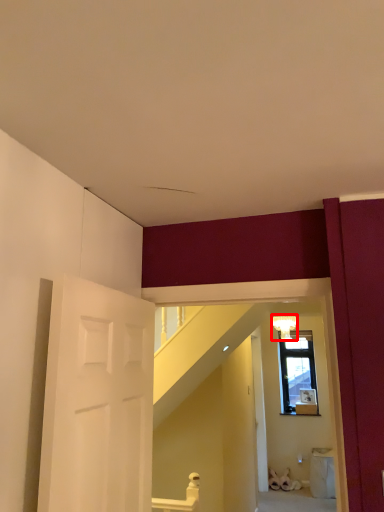
Question: From the image's perspective, where is light fixture (annotated by the red box) located in relation to door in the image?

Choices:
 (A) above
 (B) below

Answer: (A)